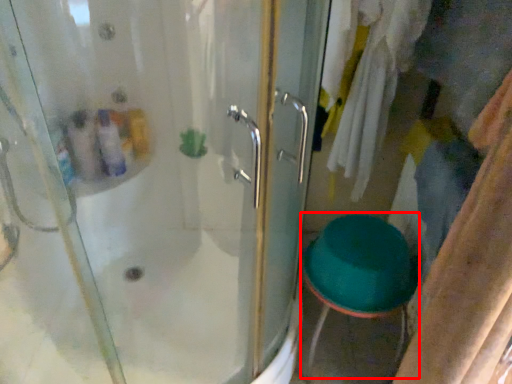
Question: From the image, what is the correct spatial relationship of step stool (annotated by the red box) in relation to door?

Choices:
 (A) left
 (B) right

Answer: (B)